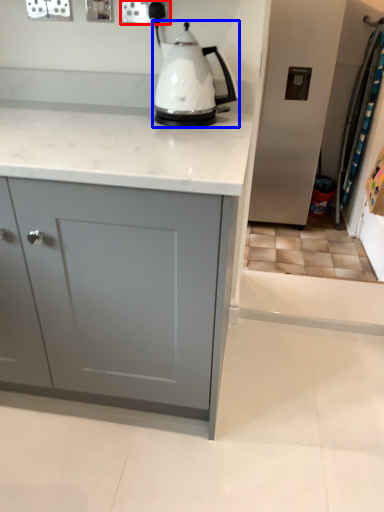
Question: Among these objects, which one is farthest to the camera, electric outlet (highlighted by a red box) or kettle (highlighted by a blue box)?

Choices:
 (A) electric outlet
 (B) kettle

Answer: (A)